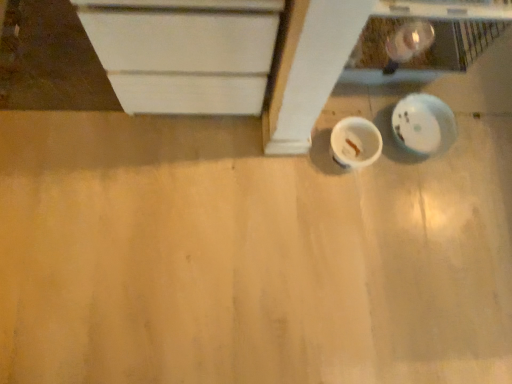
The image size is (512, 384). What do you see at coordinates (355, 142) in the screenshot?
I see `white matte cup at center` at bounding box center [355, 142].

What do you see at coordinates (184, 58) in the screenshot? I see `white matte cabinet at upper left` at bounding box center [184, 58].

Measure the distance between point (504,186) and camera.

The depth of point (504,186) is 1.34 meters.

This screenshot has height=384, width=512. What do you see at coordinates (423, 124) in the screenshot?
I see `white glossy plate at lower right` at bounding box center [423, 124].

Image resolution: width=512 pixels, height=384 pixels. I want to click on white glossy plate at lower right, so click(423, 124).

Locate an element on the screen. white matte cup at center is located at coordinates (355, 142).

Locate an element on the screen. This screenshot has width=512, height=384. plywood that is below the white glossy plate at lower right (from the image's perspective) is located at coordinates (248, 255).

Is white glossy plate at lower right oriented away from matte white plywood at lower right?

white glossy plate at lower right does not have its back to matte white plywood at lower right.

From a real-world perspective, is white glossy plate at lower right above or below matte white plywood at lower right?

Clearly, from a real-world perspective, white glossy plate at lower right is above matte white plywood at lower right.

Between point (428, 142) and point (369, 229), which one is positioned behind?

The point (428, 142) is more distant.

From the image's perspective, which is below, matte white plywood at lower right or white matte cup at center?

From the image's view, matte white plywood at lower right is below.

Does point (20, 280) come in front of point (338, 124)?

Yes, it is.

How many degrees apart are the facing directions of matte white plywood at lower right and white matte cup at center?

matte white plywood at lower right and white matte cup at center are facing 2.62 degrees away from each other.

From the image's perspective, which object appears higher, white matte cup at center or white matte cabinet at upper left?

white matte cabinet at upper left, from the image's perspective.

Considering the sizes of white matte cup at center and white matte cabinet at upper left in the image, is white matte cup at center bigger or smaller than white matte cabinet at upper left?

white matte cup at center is smaller than white matte cabinet at upper left.

Between point (337, 158) and point (153, 59), which one is positioned in front?

Point (153, 59)

Would you say white matte cabinet at upper left is part of white matte cup at center's contents?

No, white matte cabinet at upper left is not inside white matte cup at center.

Which of these two, white matte cup at center or matte white plywood at lower right, is bigger?

matte white plywood at lower right is bigger.

Can you confirm if white matte cup at center is positioned to the left of matte white plywood at lower right?

Incorrect, white matte cup at center is not on the left side of matte white plywood at lower right.

Is white matte cup at center not near matte white plywood at lower right?

No, white matte cup at center is not far from matte white plywood at lower right.

Can you tell me how much white matte cup at center and matte white plywood at lower right differ in facing direction?

There is a 2.62-degree angle between the facing directions of white matte cup at center and matte white plywood at lower right.

Which object is closer to the camera, white glossy plate at lower right or white matte cup at center?

white matte cup at center is in front.

Would you say white glossy plate at lower right is outside white matte cup at center?

Yes, white glossy plate at lower right is located beyond the bounds of white matte cup at center.

From a real-world perspective, between white glossy plate at lower right and white matte cup at center, who is vertically higher?

In real-world perspective, white matte cup at center is above.

Looking at their sizes, would you say white glossy plate at lower right is wider or thinner than white matte cup at center?

Considering their sizes, white glossy plate at lower right looks broader than white matte cup at center.

Could you tell me if white matte cup at center is facing white glossy plate at lower right?

No, white matte cup at center is not aimed at white glossy plate at lower right.

Which is in front, white matte cup at center or white glossy plate at lower right?

white matte cup at center is in front.

Consider the image. Is white matte cup at center surrounding white glossy plate at lower right?

No, white glossy plate at lower right is not surrounded by white matte cup at center.

Between white matte cabinet at upper left and white glossy plate at lower right, which one appears on the right side from the viewer's perspective?

white glossy plate at lower right is more to the right.

Looking at this image, is white glossy plate at lower right inside white matte cabinet at upper left?

No, white glossy plate at lower right is not inside white matte cabinet at upper left.

How different are the orientations of white matte cabinet at upper left and white glossy plate at lower right in degrees?

There is a 6.46-degree angle between the facing directions of white matte cabinet at upper left and white glossy plate at lower right.

Image resolution: width=512 pixels, height=384 pixels. I want to click on plywood below the white glossy plate at lower right (from a real-world perspective), so click(x=248, y=255).

Find the location of a particular element. The width and height of the screenshot is (512, 384). tableware on the right of matte white plywood at lower right is located at coordinates (355, 142).

Based on their spatial positions, is white matte cup at center or white glossy plate at lower right further from matte white plywood at lower right?

white glossy plate at lower right is further to matte white plywood at lower right.

From the image, which object appears to be nearer to white matte cup at center, matte white plywood at lower right or white glossy plate at lower right?

Based on the image, white glossy plate at lower right appears to be nearer to white matte cup at center.

Based on their spatial positions, is matte white plywood at lower right or white matte cabinet at upper left closer to white glossy plate at lower right?

matte white plywood at lower right is positioned closer to the anchor white glossy plate at lower right.

Based on their spatial positions, is white matte cup at center or white matte cabinet at upper left closer to matte white plywood at lower right?

white matte cabinet at upper left is closer to matte white plywood at lower right.

Which object lies nearer to the anchor point white matte cabinet at upper left, matte white plywood at lower right or white glossy plate at lower right?

matte white plywood at lower right lies closer to white matte cabinet at upper left than the other object.

Based on their spatial positions, is white matte cup at center or white glossy plate at lower right closer to white matte cabinet at upper left?

Among the two, white matte cup at center is located nearer to white matte cabinet at upper left.

When comparing their distances from white matte cup at center, does white glossy plate at lower right or white matte cabinet at upper left seem further?

Based on the image, white matte cabinet at upper left appears to be further to white matte cup at center.

Which object lies nearer to the anchor point white glossy plate at lower right, white matte cabinet at upper left or white matte cup at center?

The object closer to white glossy plate at lower right is white matte cup at center.

Where is `plywood between white matte cabinet at upper left and white glossy plate at lower right from left to right`? Image resolution: width=512 pixels, height=384 pixels. plywood between white matte cabinet at upper left and white glossy plate at lower right from left to right is located at coordinates (248, 255).

Locate an element on the screen. The image size is (512, 384). tableware between matte white plywood at lower right and white glossy plate at lower right is located at coordinates (355, 142).

This screenshot has width=512, height=384. I want to click on tableware between white matte cabinet at upper left and white glossy plate at lower right, so click(x=355, y=142).

Find the location of a particular element. This screenshot has width=512, height=384. tableware that lies between white matte cabinet at upper left and matte white plywood at lower right from top to bottom is located at coordinates (355, 142).